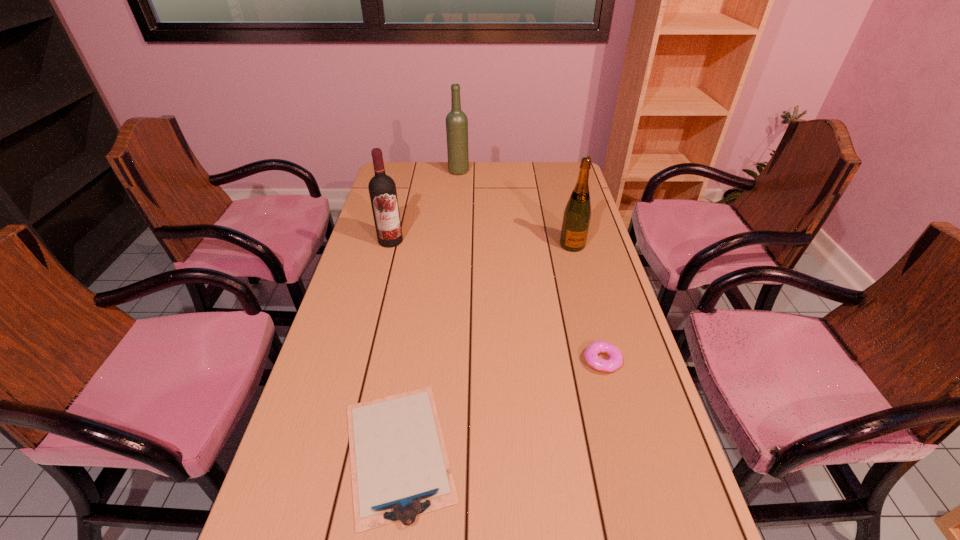
Where is `vacant space at the right edge of the desktop`? This screenshot has width=960, height=540. vacant space at the right edge of the desktop is located at coordinates (620, 490).

Identify the location of free spot between the second wine bottle from left to right and the nearest object. (428, 311).

Find the location of a particular element. The image size is (960, 540). free space between the shortest object and the doughnut is located at coordinates (500, 406).

The image size is (960, 540). Find the location of `free space between the leftmost wine bottle and the second wine bottle from right to left`. free space between the leftmost wine bottle and the second wine bottle from right to left is located at coordinates (424, 206).

Locate an element on the screen. This screenshot has width=960, height=540. vacant area between the rightmost wine bottle and the shortest object is located at coordinates (486, 348).

Find the location of a particular element. The width and height of the screenshot is (960, 540). unoccupied area between the leftmost wine bottle and the fourth tallest object is located at coordinates (496, 301).

The width and height of the screenshot is (960, 540). In order to click on unoccupied area between the farthest wine bottle and the second nearest object in this screenshot , I will do `click(531, 266)`.

At what (x,y) coordinates should I click in order to perform the action: click on free space between the clipboard and the rightmost wine bottle. Please return your answer as a coordinate pair (x, y). Image resolution: width=960 pixels, height=540 pixels. Looking at the image, I should click on (486, 348).

Image resolution: width=960 pixels, height=540 pixels. Find the location of `vacant area between the second wine bottle from right to left and the rightmost wine bottle`. vacant area between the second wine bottle from right to left and the rightmost wine bottle is located at coordinates (516, 208).

This screenshot has width=960, height=540. Identify the location of blank region between the rightmost wine bottle and the clipboard. (486, 348).